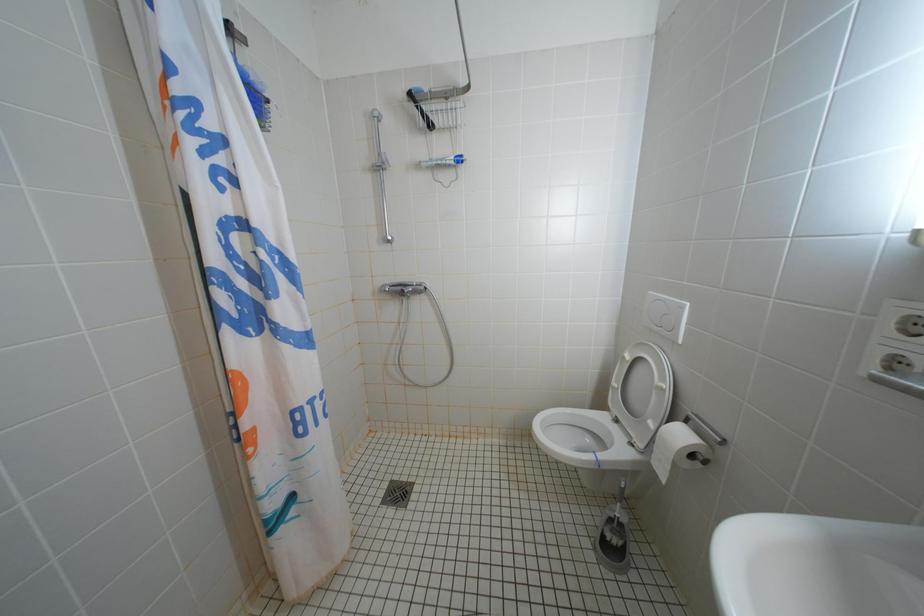
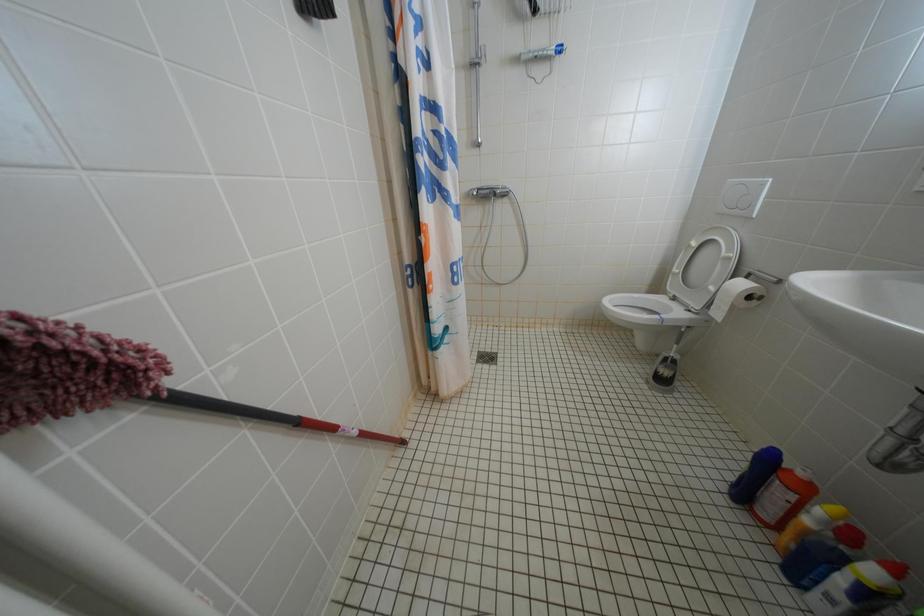
In a continuous first-person perspective shot, in which direction is the camera moving?

The cameraman moved toward left, backward.